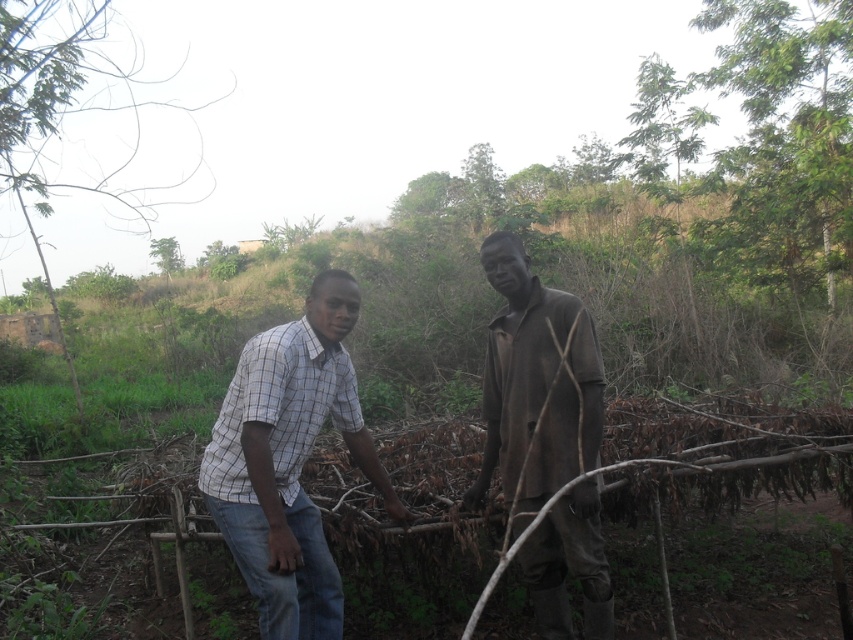
Question: Is checkered fabric shirt at center thinner than green leafy tree at upper center?

Choices:
 (A) no
 (B) yes

Answer: (B)

Question: Which point is closer to the camera?

Choices:
 (A) brown matte shirt at center
 (B) green leafy tree at left

Answer: (A)

Question: Is brown matte shirt at center to the right of green leafy tree at left from the viewer's perspective?

Choices:
 (A) no
 (B) yes

Answer: (B)

Question: Among these objects, which one is nearest to the camera?

Choices:
 (A) checkered fabric shirt at center
 (B) brown matte shirt at center
 (C) green leafy tree at left
 (D) green leafy tree at upper center

Answer: (A)

Question: Which is nearer to the green leafy tree at left?

Choices:
 (A) brown matte shirt at center
 (B) green leafy tree at upper center

Answer: (B)

Question: Does checkered fabric shirt at center appear on the right side of brown matte shirt at center?

Choices:
 (A) yes
 (B) no

Answer: (B)